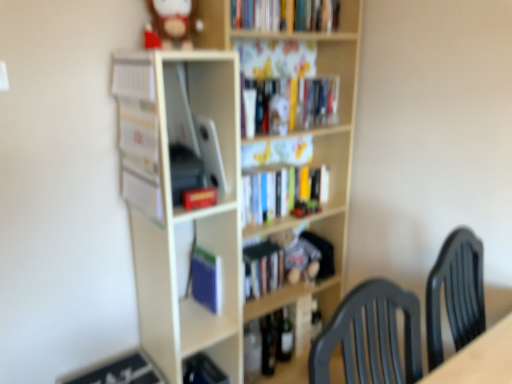
Question: In which direction should I rotate to look at black glass wine bottle at lower center, which is the first wine bottle in left-to-right order?

Choices:
 (A) right
 (B) left

Answer: (A)

Question: From a real-world perspective, does fuzzy fabric teddy bear at center, which appears as the 2th toy when viewed from the left, stand above matte black book at lower left, placed as the 6th book when sorted from top to bottom?

Choices:
 (A) no
 (B) yes

Answer: (B)

Question: Would you say fuzzy fabric teddy bear at center, placed as the first toy when sorted from back to front, is outside matte black book at lower left, placed as the first book when sorted from bottom to top?

Choices:
 (A) yes
 (B) no

Answer: (A)

Question: Does fuzzy fabric teddy bear at center, placed as the first toy when sorted from back to front, turn towards matte black book at lower left, placed as the first book when sorted from bottom to top?

Choices:
 (A) yes
 (B) no

Answer: (B)

Question: Is fuzzy fabric teddy bear at center, the second toy positioned from the top, bigger than matte black book at lower left, placed as the 6th book when sorted from top to bottom?

Choices:
 (A) no
 (B) yes

Answer: (B)

Question: Does fuzzy fabric teddy bear at center, the 1th toy from the right, lie in front of matte black book at lower left, placed as the 6th book when sorted from top to bottom?

Choices:
 (A) no
 (B) yes

Answer: (A)

Question: Considering the relative sizes of fuzzy fabric teddy bear at center, placed as the first toy when sorted from back to front, and matte black book at lower left, placed as the first book when sorted from bottom to top, in the image provided, is fuzzy fabric teddy bear at center, placed as the first toy when sorted from back to front, taller than matte black book at lower left, placed as the first book when sorted from bottom to top,?

Choices:
 (A) no
 (B) yes

Answer: (B)

Question: Considering the relative sizes of black glass wine bottle at lower center, which is the first wine bottle in left-to-right order, and matte red book at center, the 3th book ordered from the bottom, in the image provided, is black glass wine bottle at lower center, which is the first wine bottle in left-to-right order, wider than matte red book at center, the 3th book ordered from the bottom,?

Choices:
 (A) no
 (B) yes

Answer: (B)

Question: From a real-world perspective, is black glass wine bottle at lower center, the 2th wine bottle when ordered from right to left, below matte red book at center, which is the fourth book in top-to-bottom order?

Choices:
 (A) no
 (B) yes

Answer: (B)

Question: Considering the relative sizes of black glass wine bottle at lower center, which is the first wine bottle in left-to-right order, and matte red book at center, the 3th book ordered from the bottom, in the image provided, is black glass wine bottle at lower center, which is the first wine bottle in left-to-right order, shorter than matte red book at center, the 3th book ordered from the bottom,?

Choices:
 (A) yes
 (B) no

Answer: (B)

Question: Is black glass wine bottle at lower center, the 2th wine bottle when ordered from right to left, thinner than matte red book at center, the 3th book ordered from the bottom?

Choices:
 (A) yes
 (B) no

Answer: (B)

Question: Is black glass wine bottle at lower center, which is the first wine bottle in left-to-right order, in front of matte red book at center, the 3th book ordered from the bottom?

Choices:
 (A) yes
 (B) no

Answer: (B)

Question: Is black glass wine bottle at lower center, the 2th wine bottle when ordered from right to left, directly adjacent to matte red book at center, which is the fourth book in top-to-bottom order?

Choices:
 (A) no
 (B) yes

Answer: (A)

Question: Is white paper at left, which appears as the fourth book when ordered from the bottom, taller than white matte bookshelf at center, the first shelf when ordered from left to right?

Choices:
 (A) no
 (B) yes

Answer: (A)